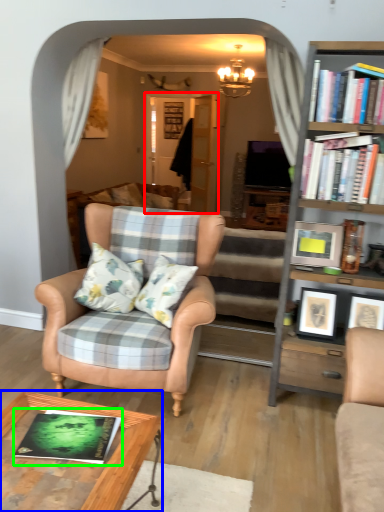
Question: Based on their relative distances, which object is nearer to glass door (highlighted by a red box)? Choose from table (highlighted by a blue box) and book (highlighted by a green box).

Choices:
 (A) table
 (B) book

Answer: (A)